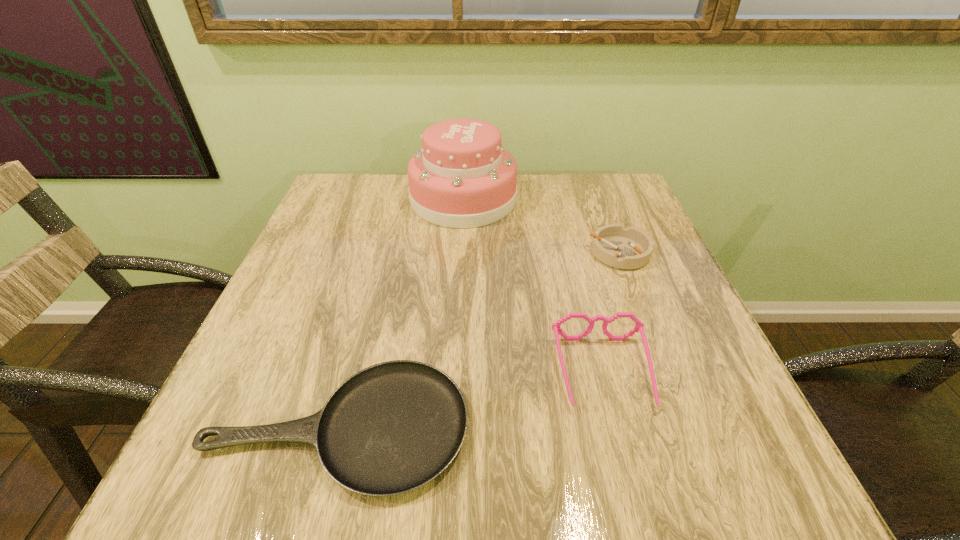
At what (x,y) coordinates should I click in order to perform the action: click on free space at the far left corner of the desktop. Please return your answer as a coordinate pair (x, y). The height and width of the screenshot is (540, 960). Looking at the image, I should click on tap(320, 208).

In the image, there is a desktop. Where is `vacant space at the far right corner`? vacant space at the far right corner is located at coordinates (612, 205).

The image size is (960, 540). In order to click on vacant area that lies between the farthest object and the frying pan in this screenshot , I will do `click(400, 313)`.

In order to click on vacant space that is in between the spectacles and the second shortest object in this screenshot , I will do `click(612, 313)`.

At what (x,y) coordinates should I click in order to perform the action: click on free spot between the frying pan and the third nearest object. Please return your answer as a coordinate pair (x, y). The image size is (960, 540). Looking at the image, I should click on (478, 340).

Locate an element on the screen. vacant space that's between the third shortest object and the frying pan is located at coordinates (470, 400).

Locate an element on the screen. The image size is (960, 540). free spot between the third nearest object and the third shortest object is located at coordinates (612, 313).

This screenshot has height=540, width=960. Identify the location of free space that is in between the second farthest object and the frying pan. (478, 340).

Where is `vacant region between the frying pan and the tallest object`? vacant region between the frying pan and the tallest object is located at coordinates (400, 313).

The height and width of the screenshot is (540, 960). I want to click on empty location between the second farthest object and the third shortest object, so click(x=612, y=313).